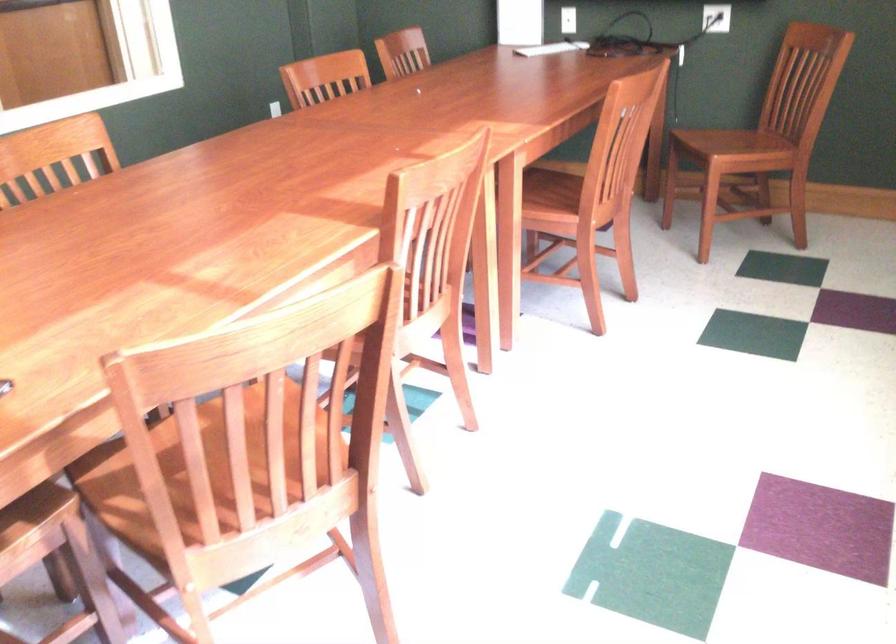
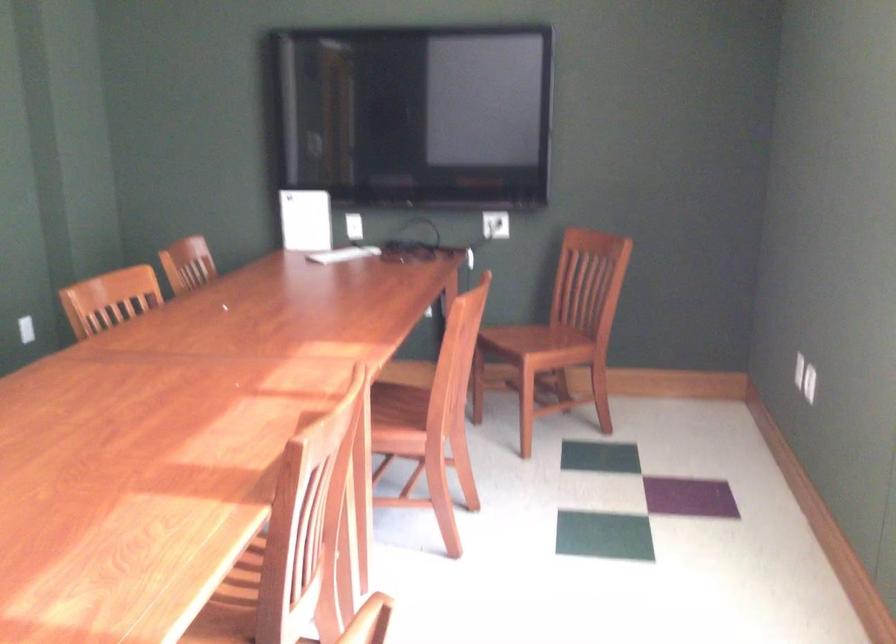
What movement of the cameraman would produce the second image?

The movement direction of the cameraman is left, forward.